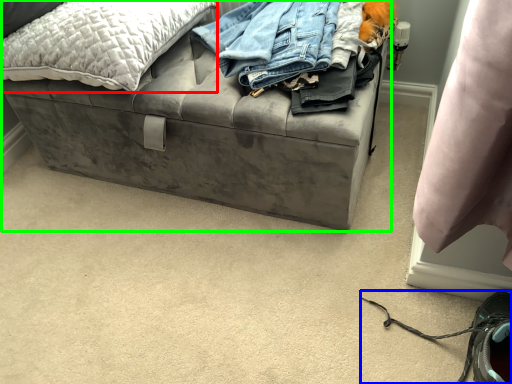
Question: Which object is positioned farthest from pillow (highlighted by a red box)? Select from shoe (highlighted by a blue box) and furniture (highlighted by a green box).

Choices:
 (A) shoe
 (B) furniture

Answer: (A)